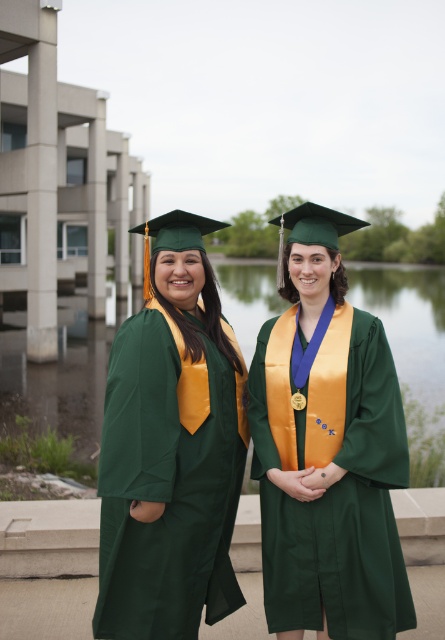
Does green matte graduation gown at center have a lesser height compared to green matte graduation gown at left?

Yes.

Is point (322, 342) more distant than point (173, 436)?

Yes, it is.

The width and height of the screenshot is (445, 640). I want to click on green matte graduation gown at center, so click(327, 449).

Can you confirm if green matte graduation gown at center is positioned to the left of green fabric lake at center?

Indeed, green matte graduation gown at center is positioned on the left side of green fabric lake at center.

Is point (408, 592) in front of point (258, 321)?

Yes.

Between point (302, 291) and point (76, 376), which one is positioned in front?

Point (302, 291) is in front.

Where is `green matte graduation gown at center`? green matte graduation gown at center is located at coordinates (327, 449).

Which is in front, point (234, 390) or point (75, 406)?

Point (234, 390)

Between green matte graduation gown at left and green fabric lake at center, which one has less height?

green matte graduation gown at left is shorter.

Is point (210, 573) positioned behind point (89, 449)?

No, it is not.

Locate an element on the screen. The image size is (445, 640). green matte graduation gown at left is located at coordinates (170, 451).